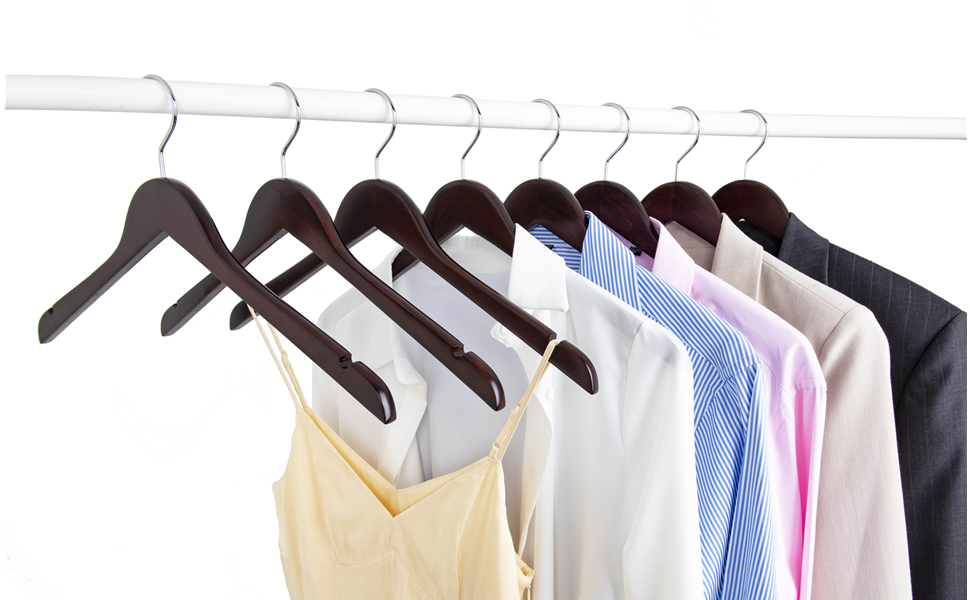
Identify the location of clothes on clothes hangers. The image size is (970, 600). (415, 526), (599, 450), (710, 416), (777, 398), (849, 394), (909, 391).